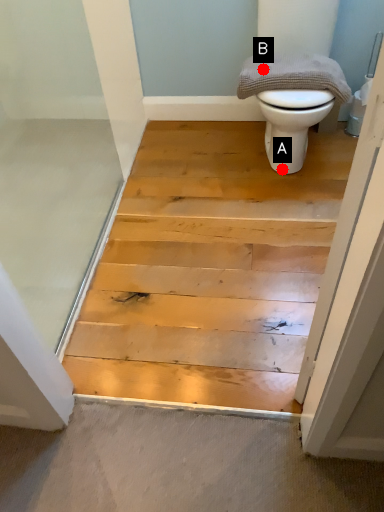
Question: Two points are circled on the image, labeled by A and B beside each circle. Which point appears closest to the camera in this image?

Choices:
 (A) A is closer
 (B) B is closer

Answer: (B)